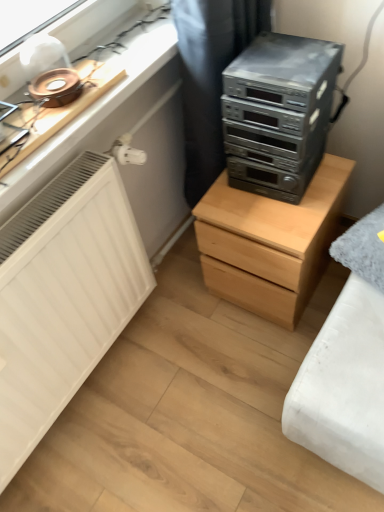
Question: In terms of size, does black fabric curtain at upper center appear bigger or smaller than satin black stereo at upper right?

Choices:
 (A) big
 (B) small

Answer: (A)

Question: Considering their positions, is black fabric curtain at upper center located in front of or behind satin black stereo at upper right?

Choices:
 (A) behind
 (B) front

Answer: (A)

Question: Based on their relative distances, which object is nearer to the black fabric curtain at upper center?

Choices:
 (A) satin black stereo at upper right
 (B) light wood chest of drawers at center

Answer: (A)

Question: Considering the real-world distances, which object is closest to the light wood chest of drawers at center?

Choices:
 (A) satin black stereo at upper right
 (B) black fabric curtain at upper center

Answer: (A)